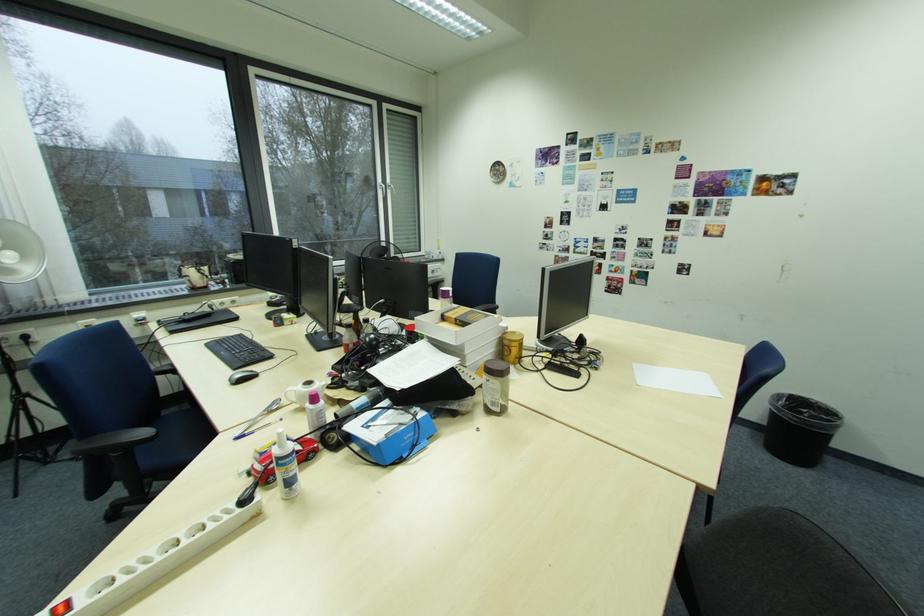
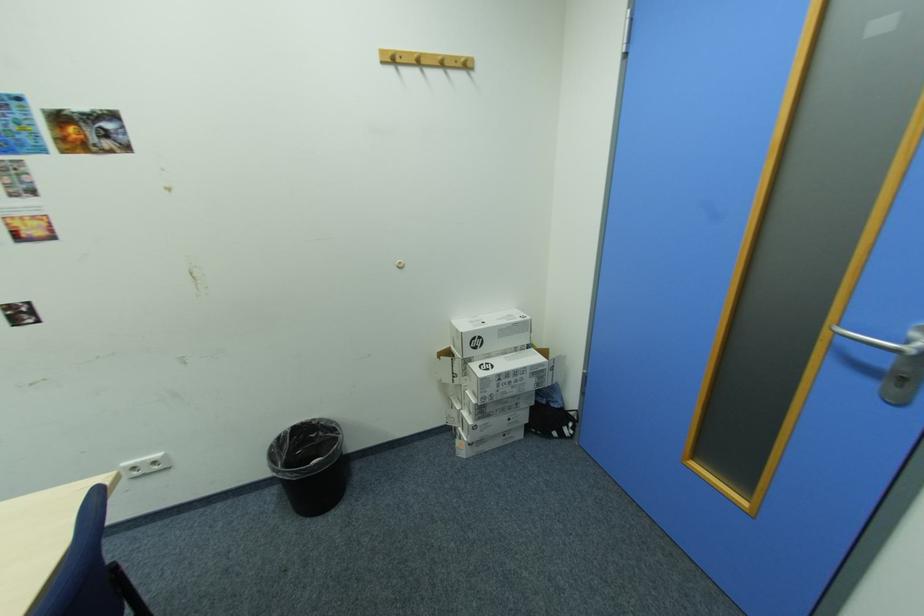
In the second image, find the point that corresponds to point 811,411 in the first image.

(322, 436)